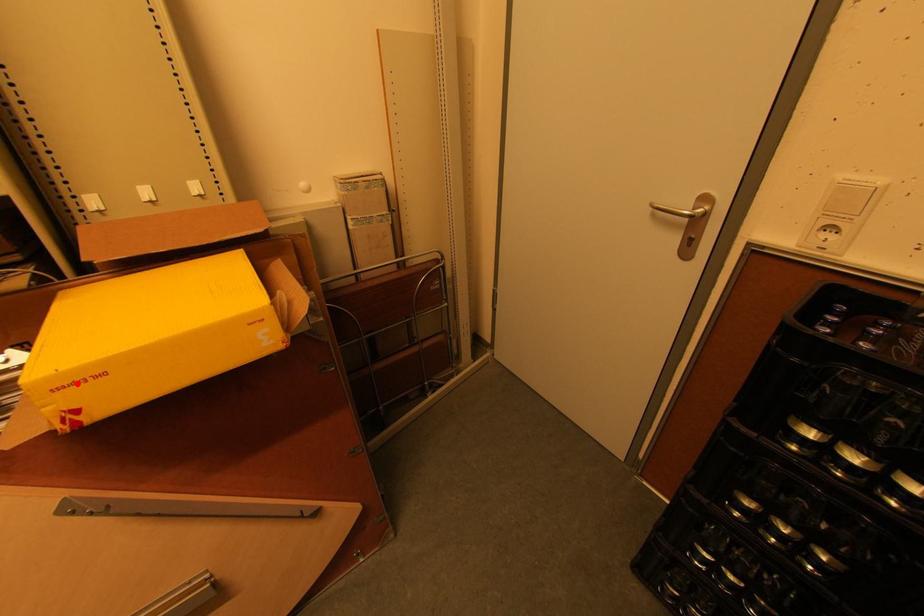
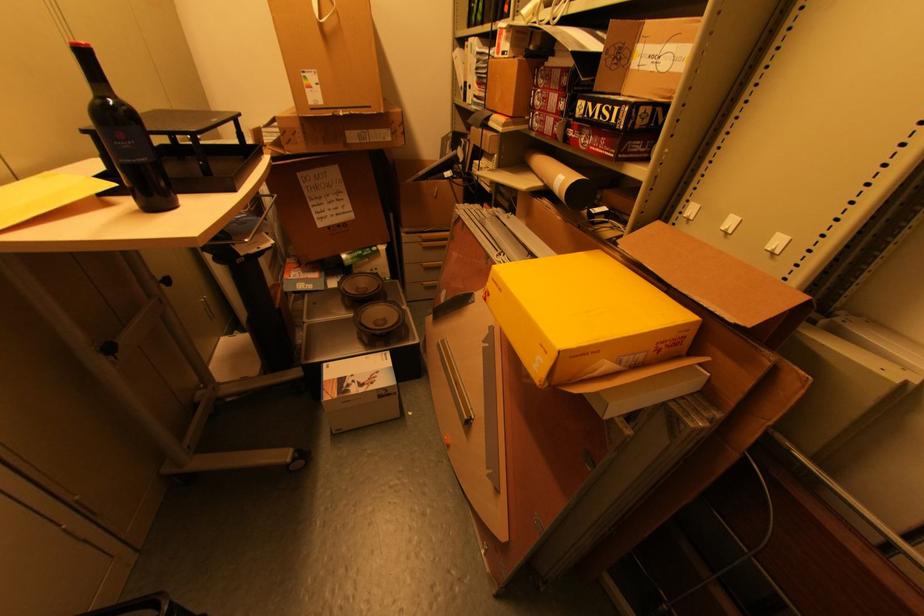
Locate, in the second image, the point that corresponds to the highlighted location in the first image.

(499, 284)